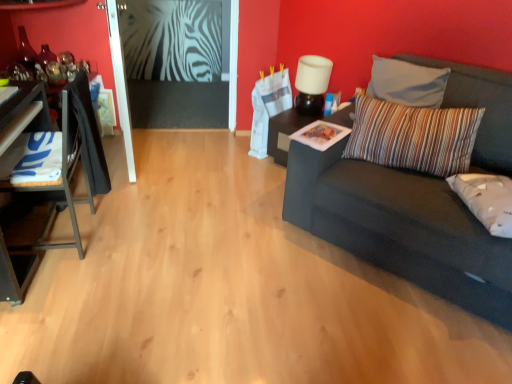
Locate an element on the screen. The width and height of the screenshot is (512, 384). free space above white matte lamp at upper center (from a real-world perspective) is located at coordinates click(317, 57).